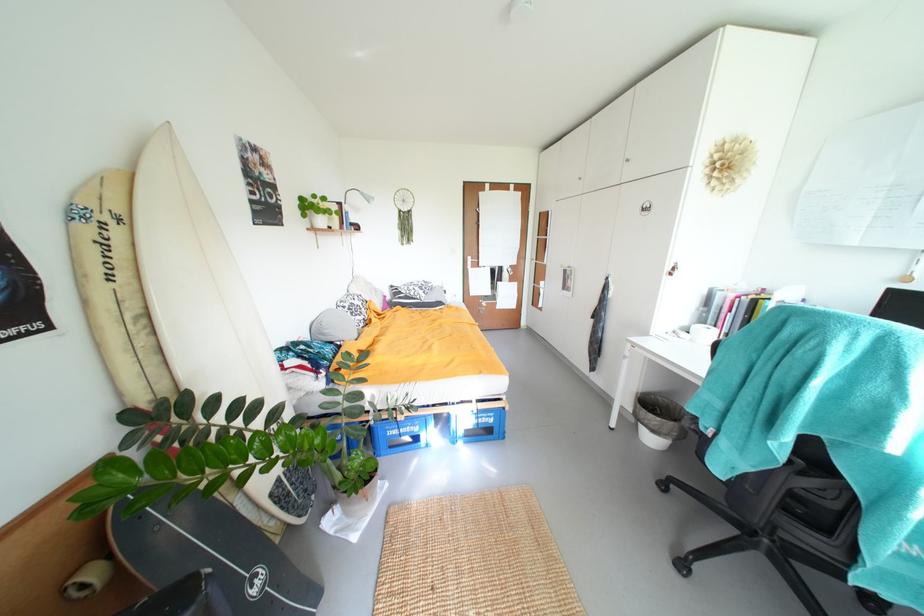
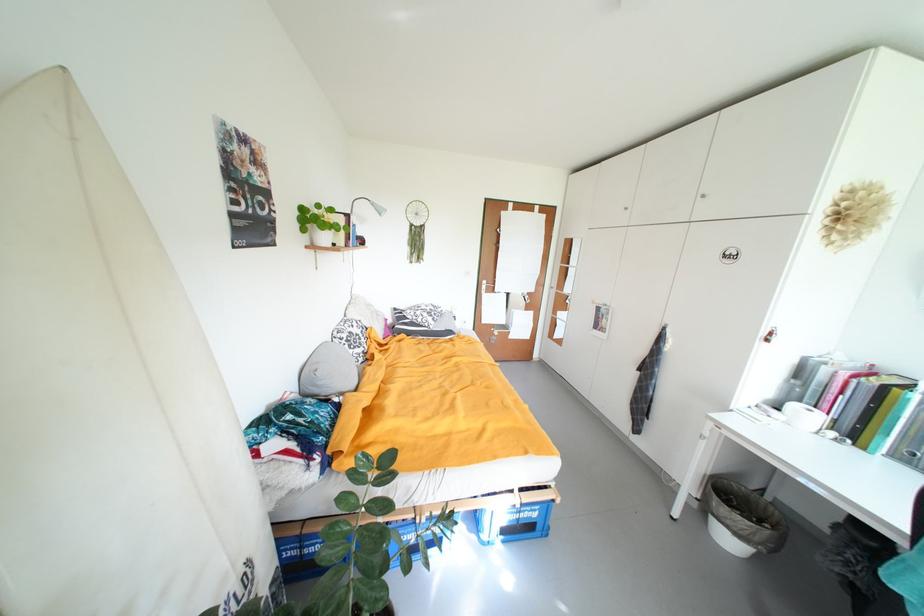
Where in the second image is the point corresponding to pixel 370 196 from the first image?

(381, 206)